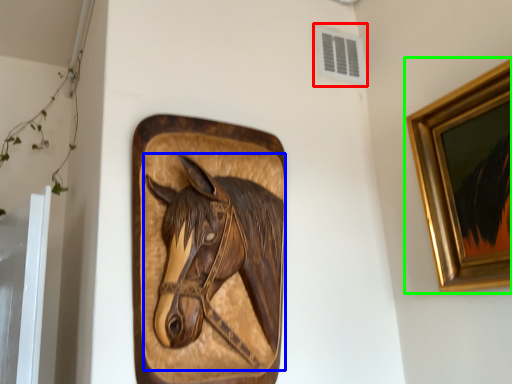
Question: Estimate the real-world distances between objects in this image. Which object is farther from air conditioning (highlighted by a red box), horse (highlighted by a blue box) or picture frame (highlighted by a green box)?

Choices:
 (A) horse
 (B) picture frame

Answer: (A)